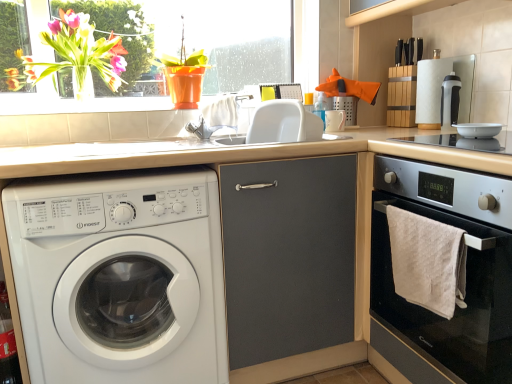
Identify the location of vacant space in front of black plastic coffee machine at upper right. (468, 133).